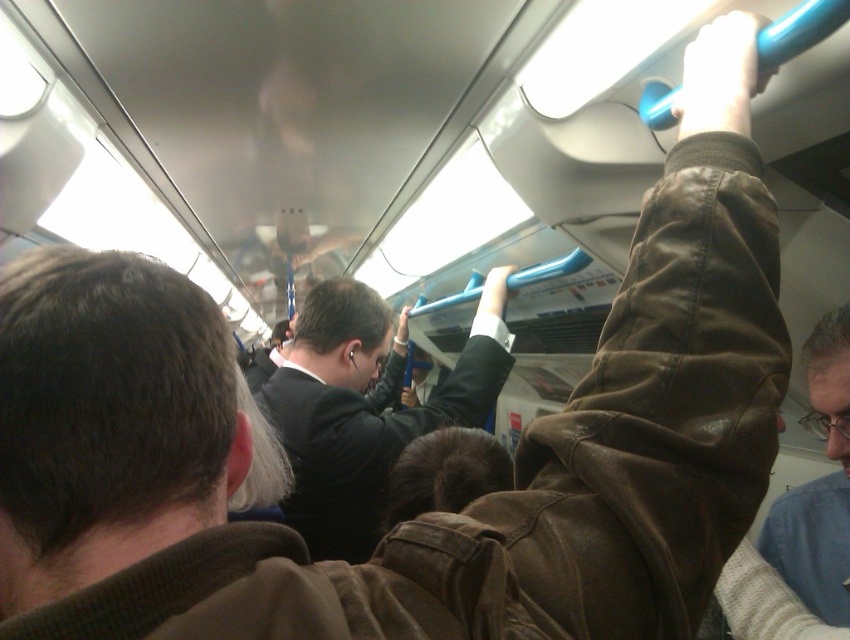
You are a passenger on the train and need to assess the height of two items to determine if a 1.8m tall luggage can fit between them. The items are the black suit at center and the light brown leather jacket at upper right. Which item is taller?

The black suit at center is taller than the light brown leather jacket at upper right, so the luggage might not fit if the taller item is an obstruction.

You are a passenger on the train and want to know if you can safely reach the black suit at center from the light brown leather jacket at upper right without moving. How far apart are they?

The black suit at center is 35.53 inches away from the light brown leather jacket at upper right, so you can safely reach them without moving.